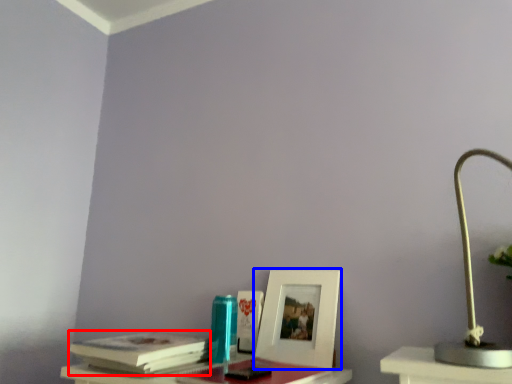
Question: Which of the following is the farthest to the observer, paperback book (highlighted by a red box) or picture frame (highlighted by a blue box)?

Choices:
 (A) paperback book
 (B) picture frame

Answer: (B)